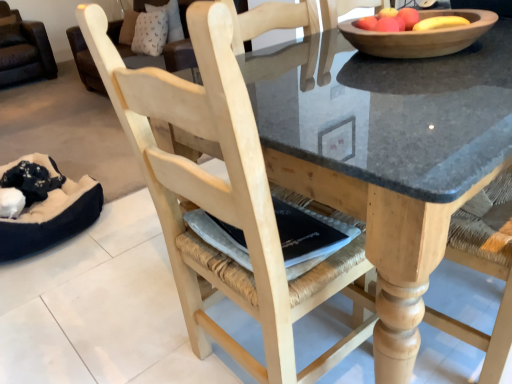
The image size is (512, 384). In order to click on vacant area situated to the left side of wooden bowl at upper center in this screenshot , I will do `click(305, 70)`.